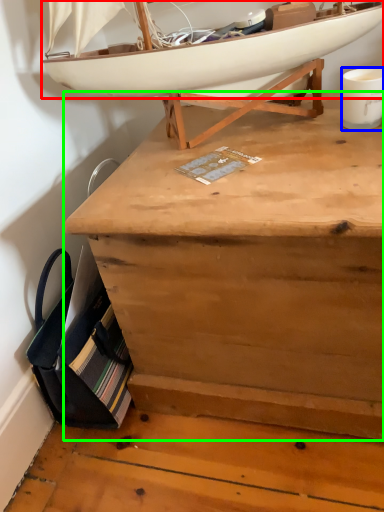
Question: Which is farther away from boat (highlighted by a red box)? coffee cup (highlighted by a blue box) or desk (highlighted by a green box)?

Choices:
 (A) coffee cup
 (B) desk

Answer: (B)